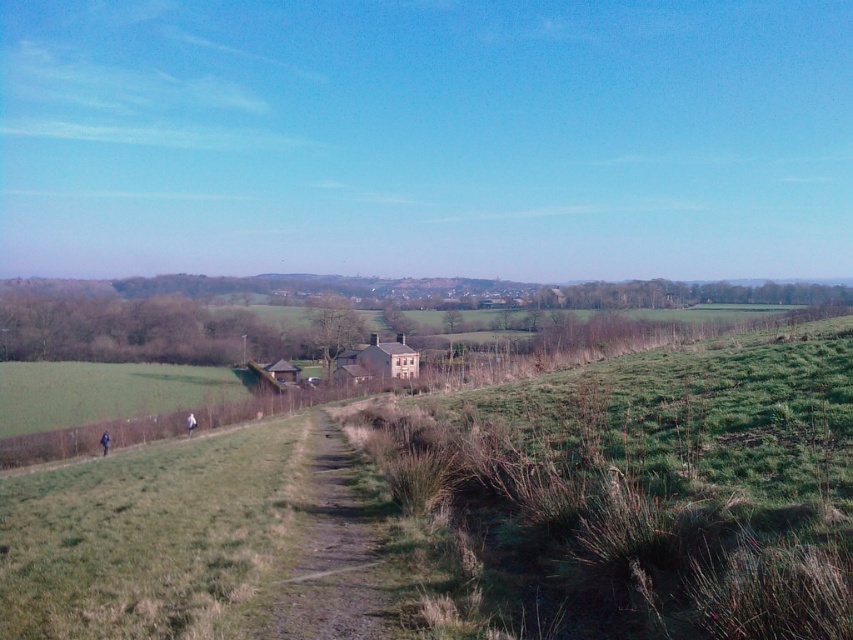
Describe the element at coordinates (657, 486) in the screenshot. I see `green grassy at center` at that location.

Is point (618, 385) positioned before point (308, 536)?

That is False.

You are a GUI agent. You are given a task and a screenshot of the screen. Output one action in this format:
    pyautogui.click(x=<x>, y=<y>)
    Task: Click on the green grassy at center
    
    Given the screenshot: What is the action you would take?
    coord(657,486)